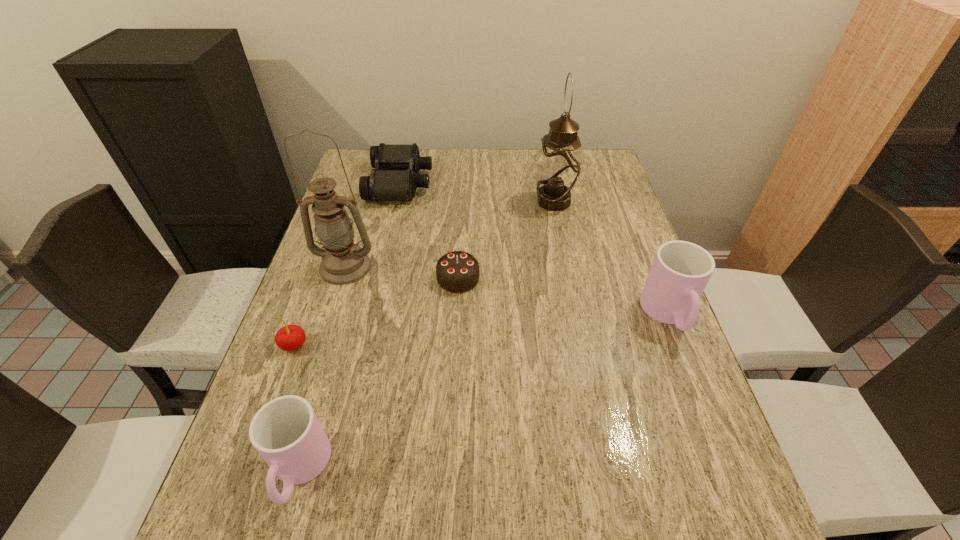
Choose which object is the nearest neighbor to the binoculars. Please provide its 2D coordinates. Your answer should be formatted as a tuple, i.e. [(x, y)], where the tuple contains the x and y coordinates of a point satisfying the conditions above.

[(343, 262)]

Find the location of `object that is the third closest one to the left oil lamp`. object that is the third closest one to the left oil lamp is located at coordinates (394, 178).

Locate an element on the screen. Image resolution: width=960 pixels, height=540 pixels. vacant space that satisfies the following two spatial constraints: 1. through the eyepieces of the binoculars; 2. on the back side of the chocolate cake is located at coordinates (378, 278).

Find the location of `vacant space that satisfies the following two spatial constraints: 1. through the eyepieces of the binoculars; 2. with the handle on the side of the nearer cup`. vacant space that satisfies the following two spatial constraints: 1. through the eyepieces of the binoculars; 2. with the handle on the side of the nearer cup is located at coordinates (334, 470).